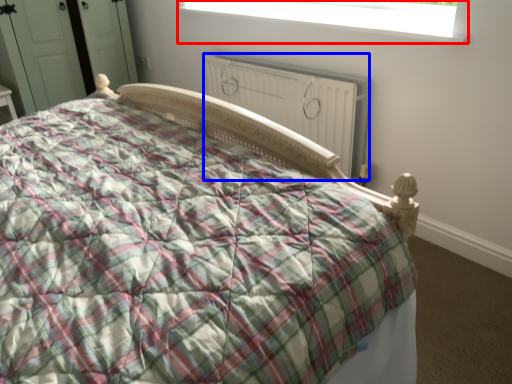
Question: Which point is further to the camera, window (highlighted by a red box) or radiator (highlighted by a blue box)?

Choices:
 (A) window
 (B) radiator

Answer: (B)